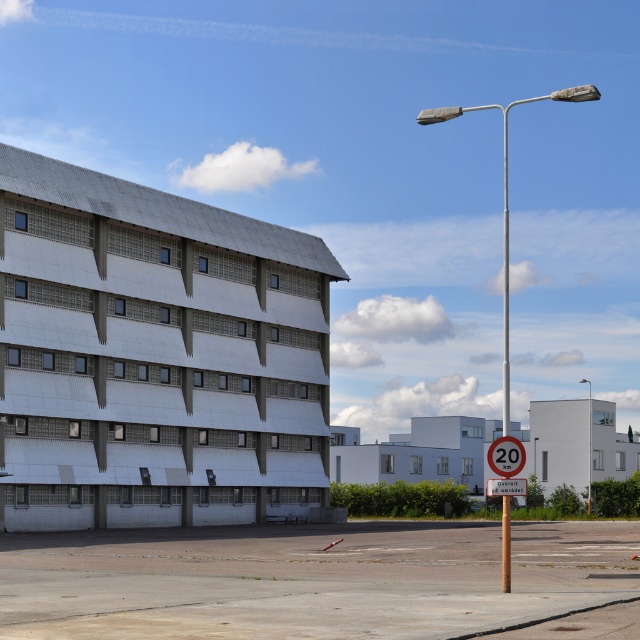
You are a city planner reviewing the urban layout. The metallic gray pole at right holds both a streetlamp and a traffic sign. Based on its position, can you determine if the pole is closer to the building or the sidewalk?

The metallic gray pole at right is located at point (506, 196), so it is closer to the building than the sidewalk.

Looking at this image, you are a pedestrian standing on the sidewalk facing the building. You notice a metallic pole at right and a red plastic speed limit sign at center. Which object is closer to your right side?

The metallic pole at right is closer to your right side because it is positioned to the right of the red plastic speed limit sign at center.